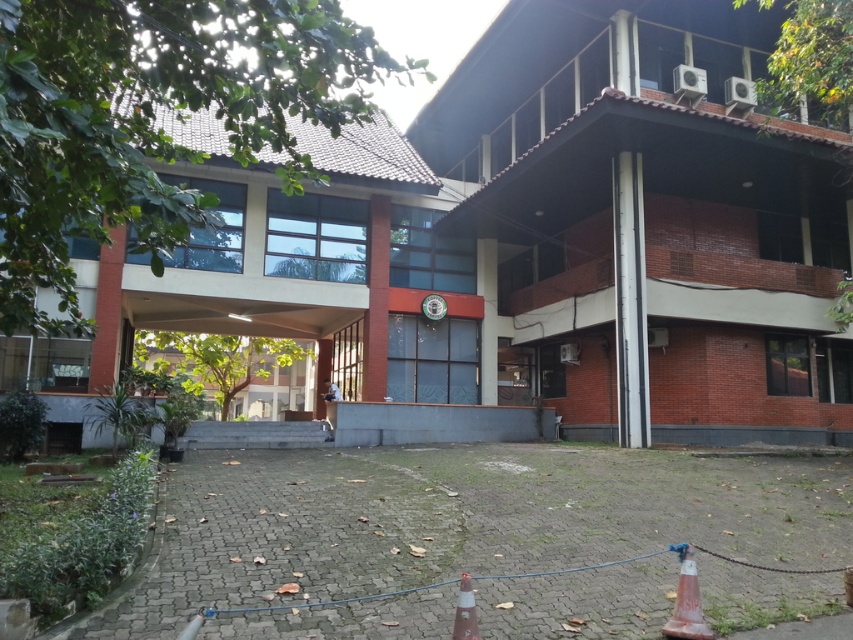
You are a delivery person trying to park your van near the orange reflective cone at lower right and the orange plastic traffic cone at lower center. To ensure safety, you need to know which cone is taller to avoid hitting it with your vehicle. Which cone should you be more cautious of?

The orange reflective cone at lower right is taller than the orange plastic traffic cone at lower center, so you should be more cautious of the orange reflective cone at lower right to avoid hitting it with your vehicle.

You are a delivery person trying to park your van near the red brick building at center and the orange reflective cone at lower right. Since the cone is a safety marker, you need to park at least 2 meters away from it. Given the layout, can you park your van between these two objects without violating the safety distance?

The red brick building at center is positioned on the left side of the orange reflective cone at lower right. Since the cone is on the right, you can park between them as long as you stay at least 2 meters away from the orange reflective cone at lower right. The building is to the left, so the distance between the cone and the building should allow this, provided the space is sufficient.

You are standing in front of the red brick building at center and want to place the orange reflective cone at lower right in a visible spot. Based on their positions, which object is nearer to you, and why?

The red brick building at center is closer to the viewer than the orange reflective cone at lower right, so the building is nearer. Therefore, placing the cone at lower right might make it less visible from your current position since it is farther away.